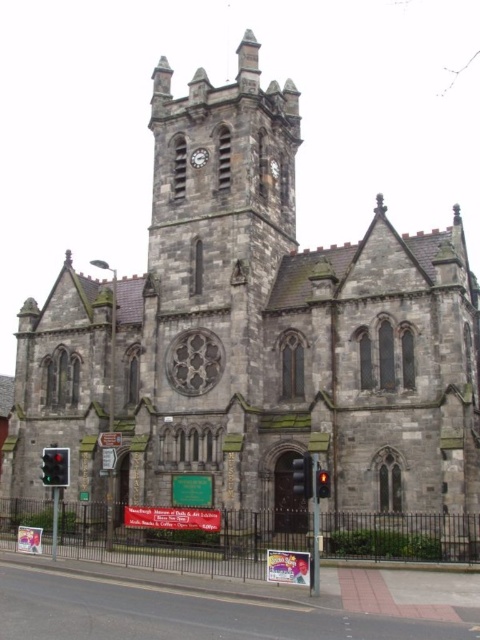
You are an architect examining the church facade. You notice both the metallic clock face at upper center and the metallic clock at upper center. Which one is smaller in size?

The metallic clock face at upper center is smaller in size compared to the metallic clock at upper center.

You are standing in front of the church and need to locate the red glass traffic light at lower left. According to the coordinates provided, where exactly should you look to find it?

The red glass traffic light at lower left is located at coordinates point (60, 467), so you should look towards the lower left area of the image at that specific coordinate point.